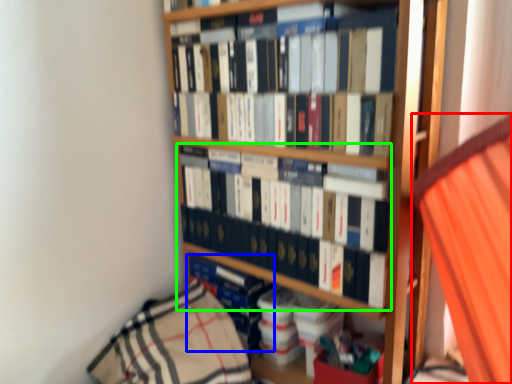
Question: Estimate the real-world distances between objects in this image. Which object is farther from curtain (highlighted by a red box), book (highlighted by a blue box) or book (highlighted by a green box)?

Choices:
 (A) book
 (B) book

Answer: (A)